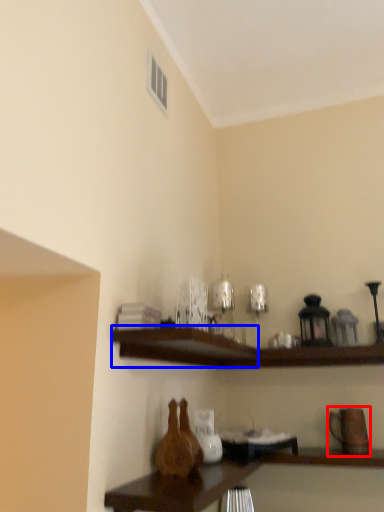
Question: Which object appears closest to the camera in this image, pottery (highlighted by a red box) or shelf (highlighted by a blue box)?

Choices:
 (A) pottery
 (B) shelf

Answer: (B)